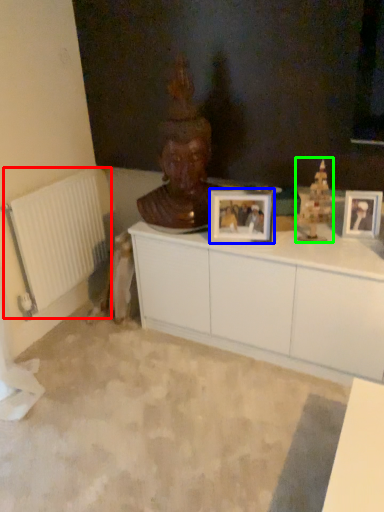
Question: Estimate the real-world distances between objects in this image. Which object is farther from radiator (highlighted by a red box), picture frame (highlighted by a blue box) or toy (highlighted by a green box)?

Choices:
 (A) picture frame
 (B) toy

Answer: (B)